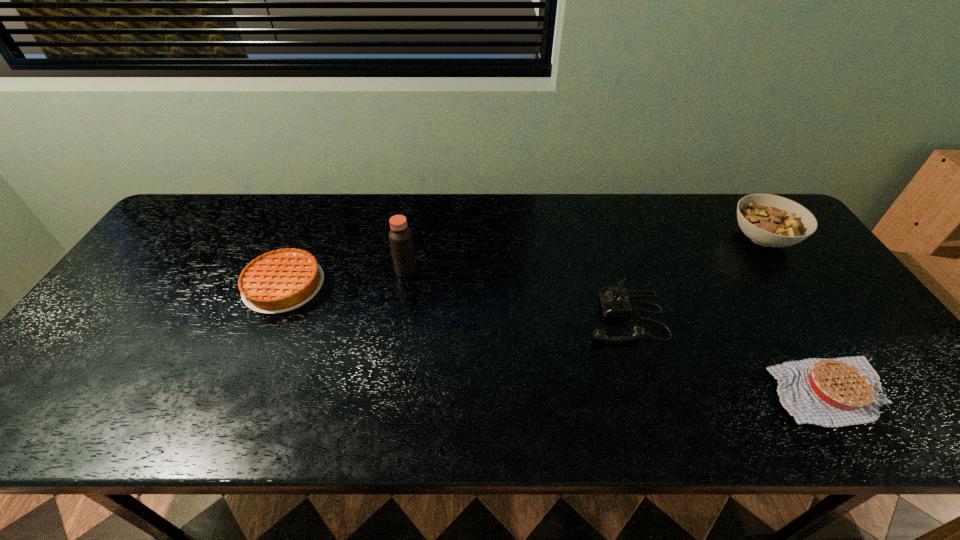
Where is `vacant area located on the left of the stew`? This screenshot has height=540, width=960. vacant area located on the left of the stew is located at coordinates (683, 239).

Locate an element on the screen. vacant space located on the dial of the telephone is located at coordinates (435, 316).

Locate an element on the screen. This screenshot has width=960, height=540. vacant point located on the dial of the telephone is located at coordinates (513, 316).

Find the location of `vacant area situated 0.380m on the dial of the telephone`. vacant area situated 0.380m on the dial of the telephone is located at coordinates (439, 316).

The image size is (960, 540). What are the coordinates of `vacant area situated 0.270m on the front of the fourth tallest object` in the screenshot? It's located at (229, 413).

Locate an element on the screen. The image size is (960, 540). free space located on the left of the right pie is located at coordinates (628, 392).

Where is `object that is at the far edge`? object that is at the far edge is located at coordinates click(x=769, y=220).

You are a GUI agent. You are given a task and a screenshot of the screen. Output one action in this format:
    pyautogui.click(x=<x>, y=<y>)
    Task: Click on the object situated at the near edge
    The image size is (960, 540).
    Given the screenshot: What is the action you would take?
    (838, 392)

Where is `stew positioned at the right edge`? Image resolution: width=960 pixels, height=540 pixels. stew positioned at the right edge is located at coordinates click(x=769, y=220).

Locate an element on the screen. This screenshot has width=960, height=540. pie that is at the right edge is located at coordinates (838, 392).